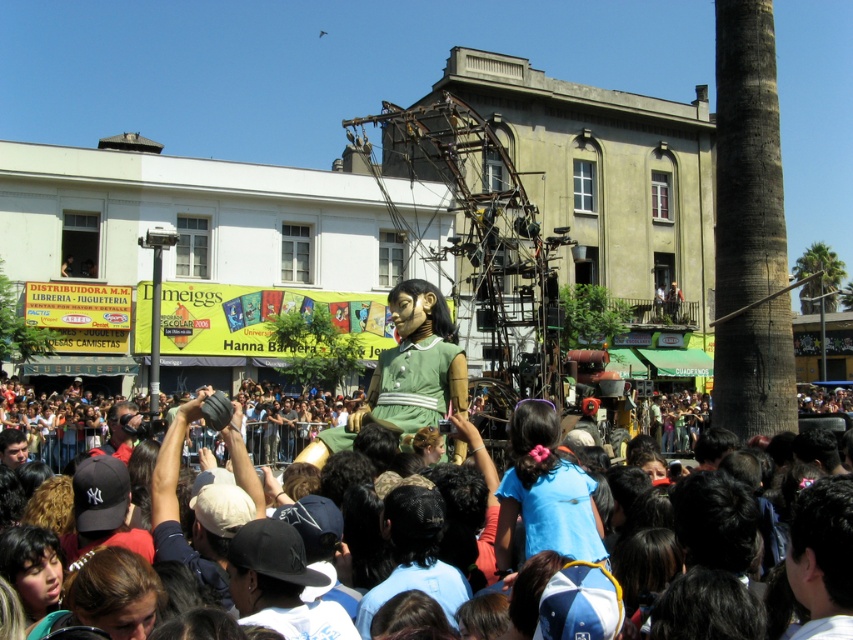
Question: Does green fabric crowd at center appear on the left side of matte black camera at lower left?

Choices:
 (A) yes
 (B) no

Answer: (B)

Question: Which point is closer to the camera taking this photo?

Choices:
 (A) (97, 448)
 (B) (752, 488)

Answer: (B)

Question: In this image, where is green fabric crowd at center located relative to matte black camera at lower left?

Choices:
 (A) below
 (B) above

Answer: (A)

Question: Does green fabric crowd at center appear on the right side of matte black camera at lower left?

Choices:
 (A) no
 (B) yes

Answer: (B)

Question: Which point is closer to the camera taking this photo?

Choices:
 (A) [x=476, y=385]
 (B) [x=119, y=422]

Answer: (B)

Question: Among these points, which one is nearest to the camera?

Choices:
 (A) (117, 449)
 (B) (764, 544)

Answer: (B)